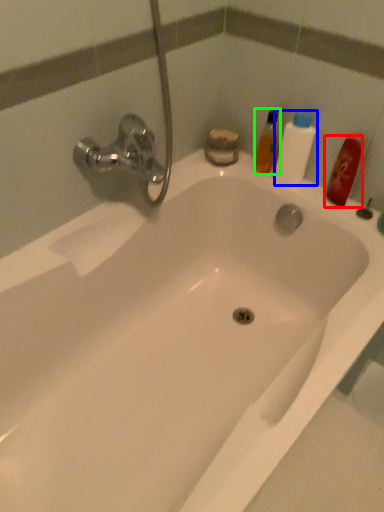
Question: Which object is the closest to the mouthwash (highlighted by a red box)? Choose among these: cleaning product (highlighted by a blue box) or mouthwash (highlighted by a green box).

Choices:
 (A) cleaning product
 (B) mouthwash

Answer: (A)